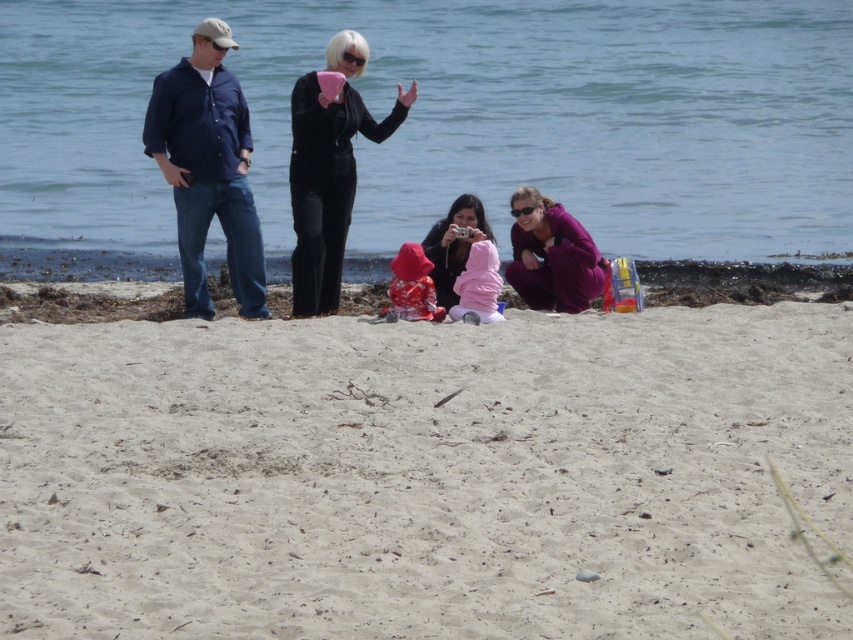
You are standing on the beach and see two points marked in the sand. The first point is at coordinates point (219,218) and the second is at point (511,230). Which point is closer to your current position?

Point (219,218) is closer to the camera than point (511,230), so the first point is closer to your current position.

From the picture: You are a photographer trying to capture a candid shot of the group on the beach. You notice the matte black camera at center and the pink fleece jacket at center in your frame. Which object should you adjust to ensure the camera is fully visible in the photo?

The pink fleece jacket at center is blocking the matte black camera at center because the camera is above the jacket. Move the jacket down or reposition the camera to ensure it is fully visible.